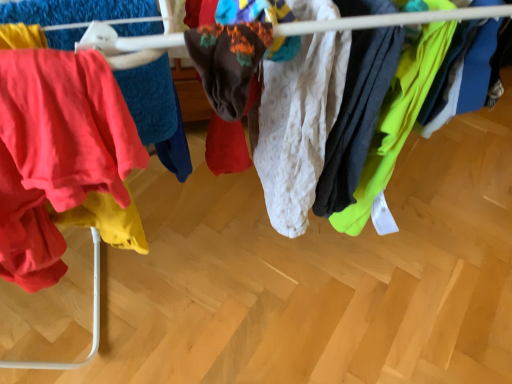
Question: In which direction should I rotate to look at white textured fabric at center, positioned as the 1th clothing in right-to-left order?

Choices:
 (A) right
 (B) left

Answer: (A)

Question: Could you tell me if white textured fabric at center, which appears as the 1th clothing when viewed from the left, is facing white textured fabric at center, the second clothing from the left?

Choices:
 (A) yes
 (B) no

Answer: (A)

Question: Could white textured fabric at center, positioned as the 1th clothing in right-to-left order, be considered to be inside white textured fabric at center, which appears as the 1th clothing when viewed from the left?

Choices:
 (A) no
 (B) yes

Answer: (A)

Question: Is white textured fabric at center, which appears as the 1th clothing when viewed from the left, to the left of white textured fabric at center, positioned as the 1th clothing in right-to-left order, from the viewer's perspective?

Choices:
 (A) no
 (B) yes

Answer: (B)

Question: Is there a large distance between white textured fabric at center, which appears as the second clothing when viewed from the right, and white textured fabric at center, the second clothing from the left?

Choices:
 (A) yes
 (B) no

Answer: (B)

Question: Is white textured fabric at center, which appears as the second clothing when viewed from the right, at the right side of white textured fabric at center, positioned as the 1th clothing in right-to-left order?

Choices:
 (A) no
 (B) yes

Answer: (A)

Question: Considering the relative sizes of white textured fabric at center, which appears as the second clothing when viewed from the right, and white textured fabric at center, the second clothing from the left, in the image provided, is white textured fabric at center, which appears as the second clothing when viewed from the right, smaller than white textured fabric at center, the second clothing from the left,?

Choices:
 (A) yes
 (B) no

Answer: (B)

Question: Could you tell me if white textured fabric at center, the second clothing from the left, is turned towards white textured fabric at center, which appears as the 1th clothing when viewed from the left?

Choices:
 (A) yes
 (B) no

Answer: (A)

Question: Considering the relative positions of white textured fabric at center, positioned as the 1th clothing in right-to-left order, and white textured fabric at center, which appears as the second clothing when viewed from the right, in the image provided, is white textured fabric at center, positioned as the 1th clothing in right-to-left order, to the left of white textured fabric at center, which appears as the second clothing when viewed from the right, from the viewer's perspective?

Choices:
 (A) no
 (B) yes

Answer: (A)

Question: Is white textured fabric at center, the second clothing from the left, positioned in front of white textured fabric at center, which appears as the 1th clothing when viewed from the left?

Choices:
 (A) no
 (B) yes

Answer: (A)

Question: From the image's perspective, is white textured fabric at center, the second clothing from the left, located beneath white textured fabric at center, which appears as the second clothing when viewed from the right?

Choices:
 (A) yes
 (B) no

Answer: (A)

Question: From the image's perspective, does white textured fabric at center, positioned as the 1th clothing in right-to-left order, appear higher than white textured fabric at center, which appears as the second clothing when viewed from the right?

Choices:
 (A) yes
 (B) no

Answer: (B)

Question: Can you confirm if white textured fabric at center, positioned as the 1th clothing in right-to-left order, is smaller than white textured fabric at center, which appears as the 1th clothing when viewed from the left?

Choices:
 (A) no
 (B) yes

Answer: (B)

Question: Is white textured fabric at center, positioned as the 1th clothing in right-to-left order, inside the boundaries of white textured fabric at center, which appears as the second clothing when viewed from the right, or outside?

Choices:
 (A) inside
 (B) outside

Answer: (B)